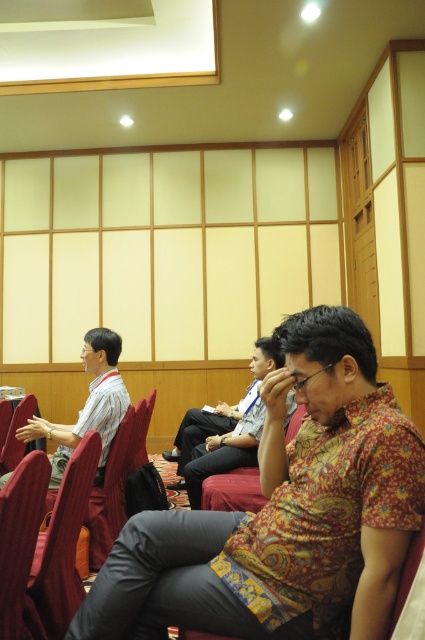
Question: Which point appears farthest from the camera in this image?

Choices:
 (A) (217, 614)
 (B) (17, 540)
 (C) (82, 412)
 (D) (31, 625)

Answer: (C)

Question: From the image, what is the correct spatial relationship of matte white shirt at left in relation to velvet-like red chair at center?

Choices:
 (A) right
 (B) left

Answer: (B)

Question: Which point appears closest to the camera in this image?

Choices:
 (A) (36, 468)
 (B) (34, 557)

Answer: (A)

Question: Is patterned fabric shirt at center thinner than red fabric chair at lower left?

Choices:
 (A) yes
 (B) no

Answer: (B)

Question: Among these objects, which one is farthest from the camera?

Choices:
 (A) red fabric chair at lower left
 (B) velvet-like red chair at center
 (C) patterned fabric shirt at center

Answer: (B)

Question: Is red fabric chair at lower left thinner than matte white shirt at left?

Choices:
 (A) no
 (B) yes

Answer: (B)